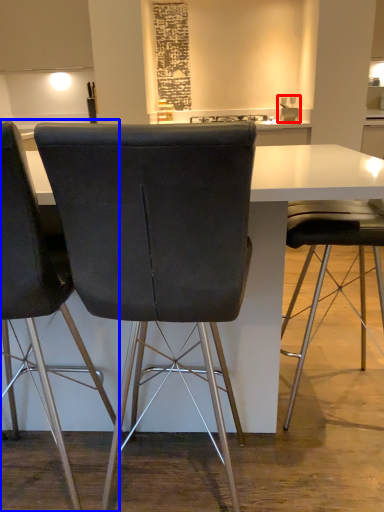
Question: Which point is further to the camera, sink (highlighted by a red box) or chair (highlighted by a blue box)?

Choices:
 (A) sink
 (B) chair

Answer: (A)